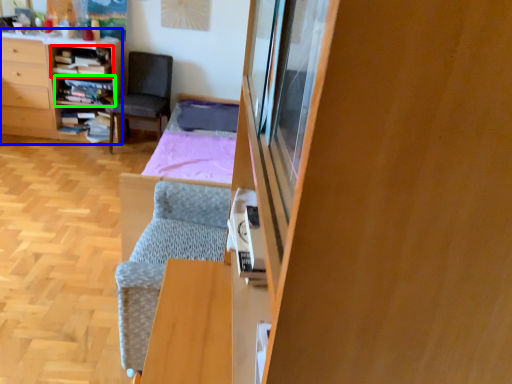
Question: Which is farther away from shelf (highlighted by a red box)? desk (highlighted by a blue box) or shelf (highlighted by a green box)?

Choices:
 (A) desk
 (B) shelf

Answer: (A)